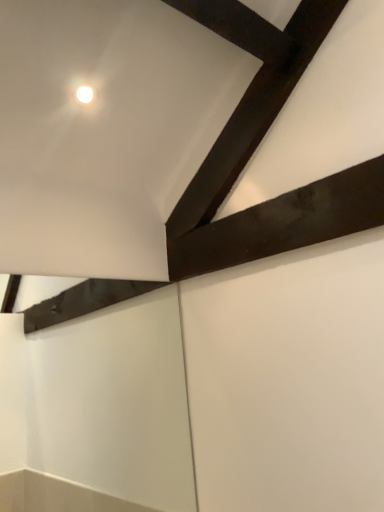
What do you see at coordinates (284, 222) in the screenshot?
I see `dark wood plank at upper right` at bounding box center [284, 222].

You are a GUI agent. You are given a task and a screenshot of the screen. Output one action in this format:
    pyautogui.click(x=<x>, y=<y>)
    Task: Click on the dark wood plank at upper right
    
    Given the screenshot: What is the action you would take?
    tap(284, 222)

I want to click on dark wood plank at upper right, so click(284, 222).